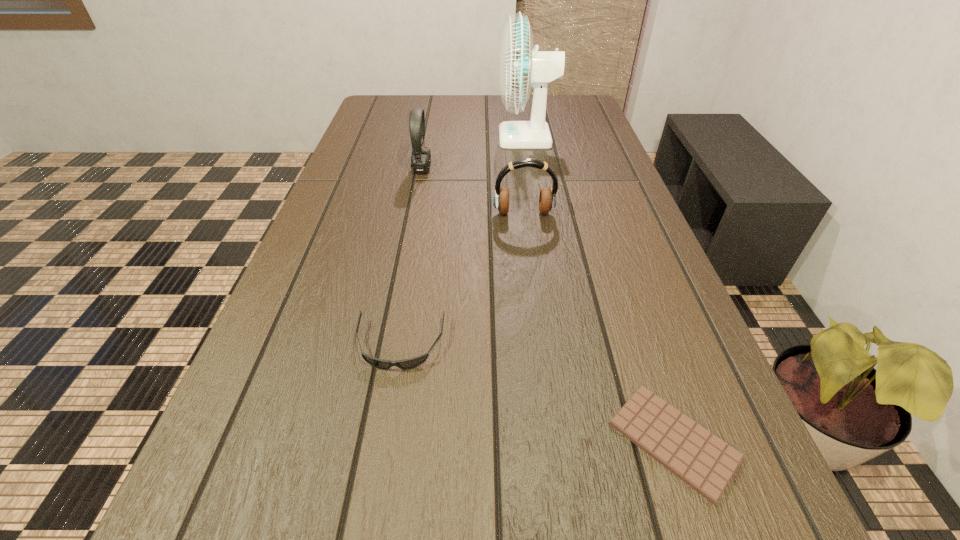
Find the location of a particular element. This screenshot has height=540, width=960. vacant position in the image that satisfies the following two spatial constraints: 1. in front of the nearest object to face the airflow; 2. on the right side of the tallest object is located at coordinates (578, 441).

Find the location of a particular element. vacant area that satisfies the following two spatial constraints: 1. in front of the tallest object to face the airflow; 2. on the ear cup of the right headset is located at coordinates (540, 213).